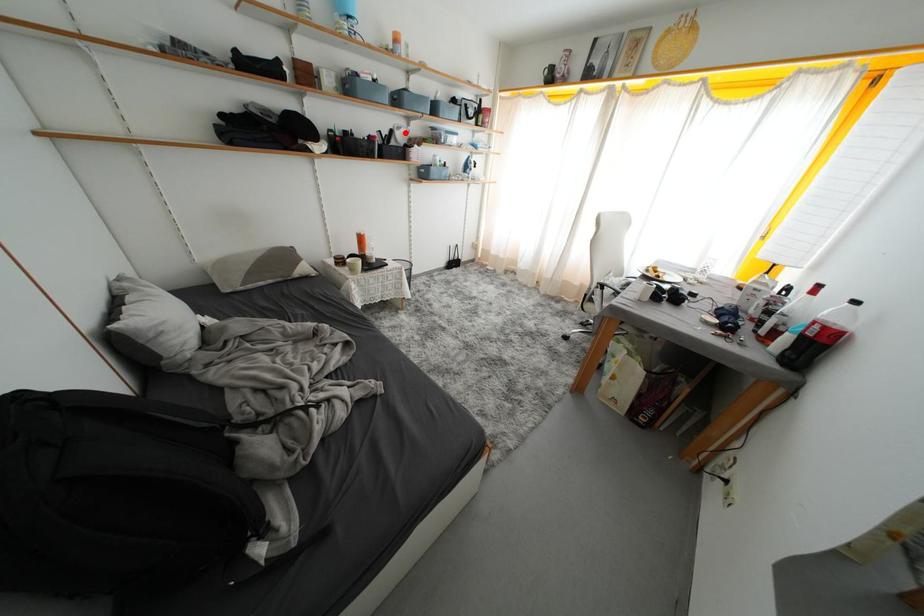
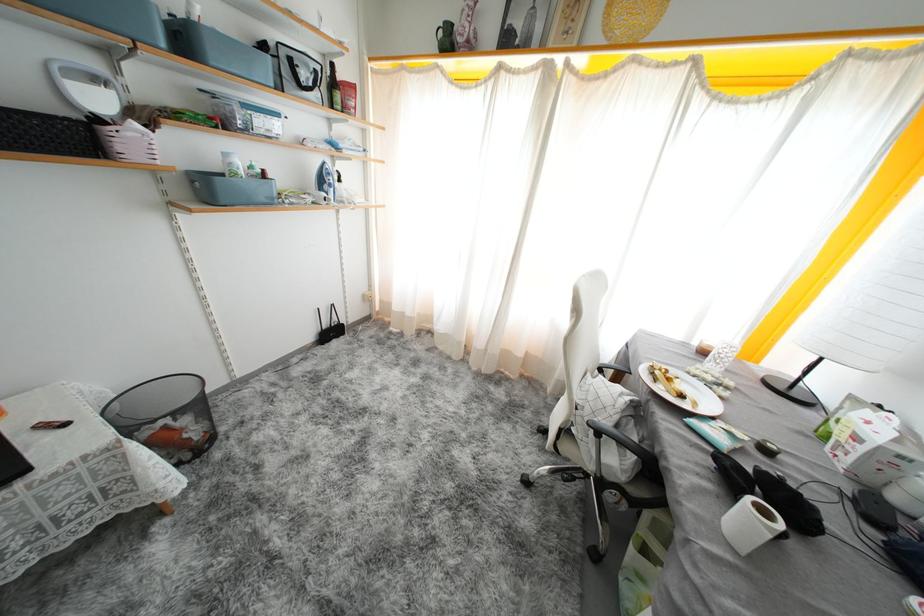
Question: A red point is marked in image1. In image2, is the corresponding 3D point closer to the camera or farther? Reply with the corresponding letter.

Choices:
 (A) The corresponding 3D point is closer.
 (B) The corresponding 3D point is farther.

Answer: (B)